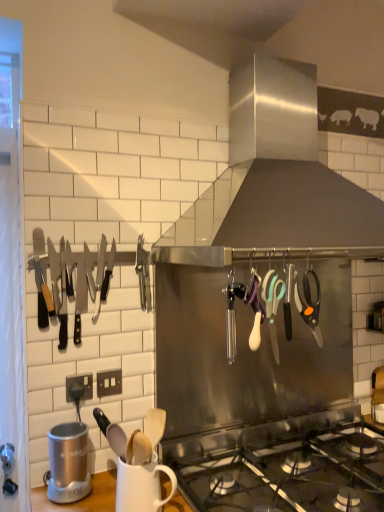
The image size is (384, 512). What do you see at coordinates (277, 174) in the screenshot?
I see `stainless steel range hood at upper center` at bounding box center [277, 174].

How much space does orange-handled scissors at center-right, positioned as the first scissors in right-to-left order, occupy horizontally?

orange-handled scissors at center-right, positioned as the first scissors in right-to-left order, is 2.78 inches in width.

The image size is (384, 512). I want to click on silver metallic blender at lower left, so click(68, 463).

What is the approximate width of teal plastic scissors at center, which is the second scissors in right-to-left order?

The width of teal plastic scissors at center, which is the second scissors in right-to-left order, is 2.72 inches.

Identify the location of stainless steel knives at left. Image resolution: width=384 pixels, height=512 pixels. (80, 279).

At what (x,y) coordinates should I click in order to perform the action: click on scissors directly beneath the orange-handled scissors at center-right, positioned as the first scissors in right-to-left order (from a real-world perspective). Please return your answer as a coordinate pair (x, y). The image size is (384, 512). Looking at the image, I should click on (272, 306).

From the image's perspective, is orange-handled scissors at center-right, positioned as the first scissors in right-to-left order, under teal plastic scissors at center, the first scissors positioned from the left?

No.

From a real-world perspective, does orange-handled scissors at center-right, positioned as the first scissors in right-to-left order, sit lower than teal plastic scissors at center, the first scissors positioned from the left?

Incorrect, from a real-world perspective, orange-handled scissors at center-right, positioned as the first scissors in right-to-left order, is higher than teal plastic scissors at center, the first scissors positioned from the left.

Is orange-handled scissors at center-right, positioned as the first scissors in right-to-left order, not within teal plastic scissors at center, which is the second scissors in right-to-left order?

Absolutely, orange-handled scissors at center-right, positioned as the first scissors in right-to-left order, is external to teal plastic scissors at center, which is the second scissors in right-to-left order.

Is orange-handled scissors at center-right, positioned as the first scissors in right-to-left order, located outside stainless steel range hood at upper center?

Yes, orange-handled scissors at center-right, positioned as the first scissors in right-to-left order, is not within stainless steel range hood at upper center.

From the picture: Is orange-handled scissors at center-right, positioned as the first scissors in right-to-left order, taller or shorter than stainless steel range hood at upper center?

orange-handled scissors at center-right, positioned as the first scissors in right-to-left order, is shorter than stainless steel range hood at upper center.

Considering the relative sizes of orange-handled scissors at center-right, positioned as the first scissors in right-to-left order, and stainless steel range hood at upper center in the image provided, is orange-handled scissors at center-right, positioned as the first scissors in right-to-left order, bigger than stainless steel range hood at upper center?

Incorrect, orange-handled scissors at center-right, positioned as the first scissors in right-to-left order, is not larger than stainless steel range hood at upper center.

Locate an element on the screen. scissors that is the 1st one below the stainless steel range hood at upper center (from a real-world perspective) is located at coordinates (309, 304).

Looking at their sizes, would you say white matte mug at lower center is wider or thinner than silver metallic blender at lower left?

In the image, white matte mug at lower center appears to be wider than silver metallic blender at lower left.

The width and height of the screenshot is (384, 512). In order to click on appliance that is on the left side of white matte mug at lower center in this screenshot , I will do `click(68, 463)`.

Which of these two, white matte mug at lower center or silver metallic blender at lower left, is smaller?

With smaller size is silver metallic blender at lower left.

How distant is white matte mug at lower center from silver metallic blender at lower left?

white matte mug at lower center is 9.16 inches from silver metallic blender at lower left.

Considering the positions of objects stainless steel range hood at upper center and stainless steel knives at left in the image provided, who is more to the right, stainless steel range hood at upper center or stainless steel knives at left?

Positioned to the right is stainless steel range hood at upper center.

From a real-world perspective, is stainless steel range hood at upper center under stainless steel knives at left?

Actually, stainless steel range hood at upper center is physically above stainless steel knives at left in the real world.

Looking at the image, does stainless steel range hood at upper center seem bigger or smaller compared to stainless steel knives at left?

In the image, stainless steel range hood at upper center appears to be larger than stainless steel knives at left.

Between stainless steel range hood at upper center and stainless steel knives at left, which one has larger width?

stainless steel range hood at upper center is wider.

Which point is more forward, (x=283, y=196) or (x=119, y=500)?

The point (x=119, y=500) is closer.

Which object is positioned more to the left, stainless steel range hood at upper center or white matte mug at lower center?

From the viewer's perspective, white matte mug at lower center appears more on the left side.

What's the angular difference between stainless steel range hood at upper center and white matte mug at lower center's facing directions?

The angular difference between stainless steel range hood at upper center and white matte mug at lower center is 1.02 degrees.

How distant is stainless steel range hood at upper center from white matte mug at lower center?

stainless steel range hood at upper center and white matte mug at lower center are 1.59 meters apart from each other.

Who is taller, teal plastic scissors at center, which is the second scissors in right-to-left order, or silver metallic blender at lower left?

teal plastic scissors at center, which is the second scissors in right-to-left order.

From the picture: How far apart are teal plastic scissors at center, the first scissors positioned from the left, and silver metallic blender at lower left?

The distance of teal plastic scissors at center, the first scissors positioned from the left, from silver metallic blender at lower left is 29.00 inches.

Is teal plastic scissors at center, which is the second scissors in right-to-left order, far from silver metallic blender at lower left?

That's not correct — teal plastic scissors at center, which is the second scissors in right-to-left order, is a little close to silver metallic blender at lower left.

From a real-world perspective, is teal plastic scissors at center, which is the second scissors in right-to-left order, physically below silver metallic blender at lower left?

No, from a real-world perspective, teal plastic scissors at center, which is the second scissors in right-to-left order, is not under silver metallic blender at lower left.

From a real-world perspective, is stainless steel range hood at upper center under orange-handled scissors at center-right, positioned as the first scissors in right-to-left order?

No, from a real-world perspective, stainless steel range hood at upper center is not beneath orange-handled scissors at center-right, positioned as the first scissors in right-to-left order.

What's the angular difference between stainless steel range hood at upper center and orange-handled scissors at center-right, the 2th scissors viewed from the left,'s facing directions?

stainless steel range hood at upper center and orange-handled scissors at center-right, the 2th scissors viewed from the left, are facing 2.86 degrees away from each other.

Is stainless steel range hood at upper center beside orange-handled scissors at center-right, the 2th scissors viewed from the left?

No, stainless steel range hood at upper center is not in contact with orange-handled scissors at center-right, the 2th scissors viewed from the left.

Is stainless steel range hood at upper center positioned before orange-handled scissors at center-right, the 2th scissors viewed from the left?

Yes, it is in front of orange-handled scissors at center-right, the 2th scissors viewed from the left.

At what (x,y) coordinates should I click in order to perform the action: click on scissors below the orange-handled scissors at center-right, positioned as the first scissors in right-to-left order (from a real-world perspective). Please return your answer as a coordinate pair (x, y). Looking at the image, I should click on (272, 306).

At what (x,y) coordinates should I click in order to perform the action: click on kitchen appliance that appears on the right of orange-handled scissors at center-right, the 2th scissors viewed from the left. Please return your answer as a coordinate pair (x, y). This screenshot has height=512, width=384. Looking at the image, I should click on (277, 174).

Looking at the image, which one is located closer to teal plastic scissors at center, the first scissors positioned from the left, stainless steel range hood at upper center or white matte mug at lower center?

white matte mug at lower center is closer to teal plastic scissors at center, the first scissors positioned from the left.

Considering their positions, is silver metallic blender at lower left positioned closer to white matte mug at lower center than teal plastic scissors at center, the first scissors positioned from the left?

silver metallic blender at lower left lies closer to white matte mug at lower center than the other object.

Based on their spatial positions, is white matte mug at lower center or stainless steel range hood at upper center closer to stainless steel knives at left?

The object closer to stainless steel knives at left is white matte mug at lower center.

Looking at the image, which one is located further to stainless steel range hood at upper center, teal plastic scissors at center, the first scissors positioned from the left, or silver metallic blender at lower left?

silver metallic blender at lower left is positioned further to the anchor stainless steel range hood at upper center.

Considering their positions, is stainless steel range hood at upper center positioned closer to teal plastic scissors at center, the first scissors positioned from the left, than stainless steel knives at left?

stainless steel knives at left lies closer to teal plastic scissors at center, the first scissors positioned from the left, than the other object.

Considering their positions, is stainless steel knives at left positioned further to orange-handled scissors at center-right, positioned as the first scissors in right-to-left order, than teal plastic scissors at center, the first scissors positioned from the left?

Among the two, stainless steel knives at left is located further to orange-handled scissors at center-right, positioned as the first scissors in right-to-left order.

From the image, which object appears to be nearer to white matte mug at lower center, silver metallic blender at lower left or stainless steel range hood at upper center?

silver metallic blender at lower left is positioned closer to the anchor white matte mug at lower center.

Looking at this image, based on their spatial positions, is orange-handled scissors at center-right, the 2th scissors viewed from the left, or silver metallic blender at lower left further from stainless steel knives at left?

orange-handled scissors at center-right, the 2th scissors viewed from the left, is positioned further to the anchor stainless steel knives at left.

You are a GUI agent. You are given a task and a screenshot of the screen. Output one action in this format:
    pyautogui.click(x=<x>, y=<y>)
    Task: Click on the appliance between stainless steel knives at left and white matte mug at lower center from top to bottom
    This screenshot has width=384, height=512.
    Given the screenshot: What is the action you would take?
    pyautogui.click(x=68, y=463)

I want to click on mug between silver metallic blender at lower left and orange-handled scissors at center-right, positioned as the first scissors in right-to-left order, in the horizontal direction, so click(142, 486).

This screenshot has height=512, width=384. In order to click on scissors that lies between stainless steel range hood at upper center and teal plastic scissors at center, which is the second scissors in right-to-left order, from top to bottom in this screenshot , I will do `click(309, 304)`.

Identify the location of cutlery located between silver metallic blender at lower left and teal plastic scissors at center, which is the second scissors in right-to-left order, in the left-right direction. pos(80,279).